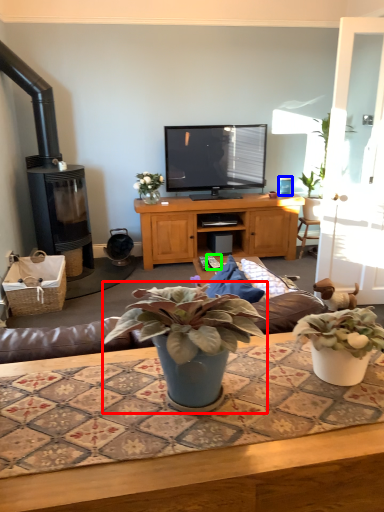
Question: Which object is the closest to the houseplant (highlighted by a red box)? Choose among these: coffee cup (highlighted by a blue box) or remote control (highlighted by a green box).

Choices:
 (A) coffee cup
 (B) remote control

Answer: (B)